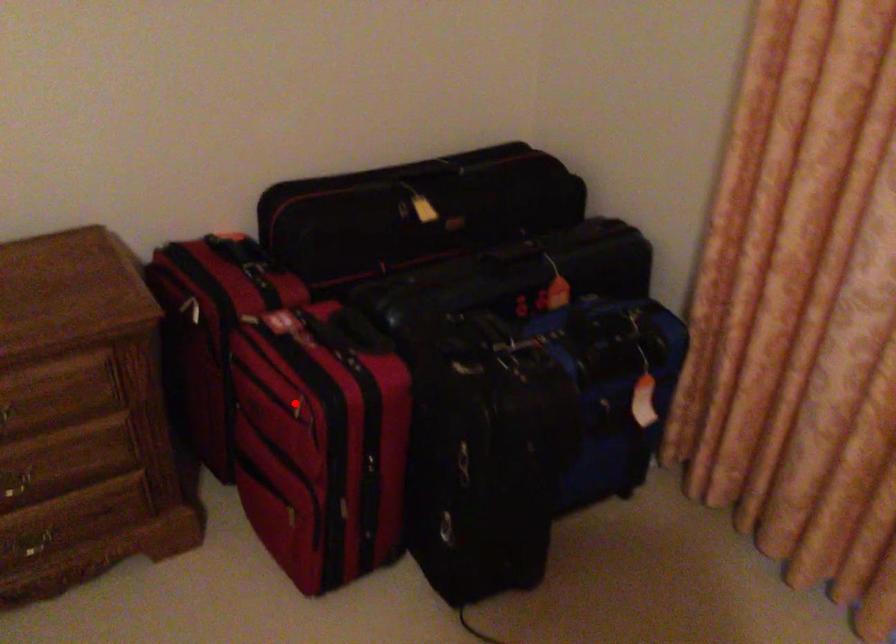
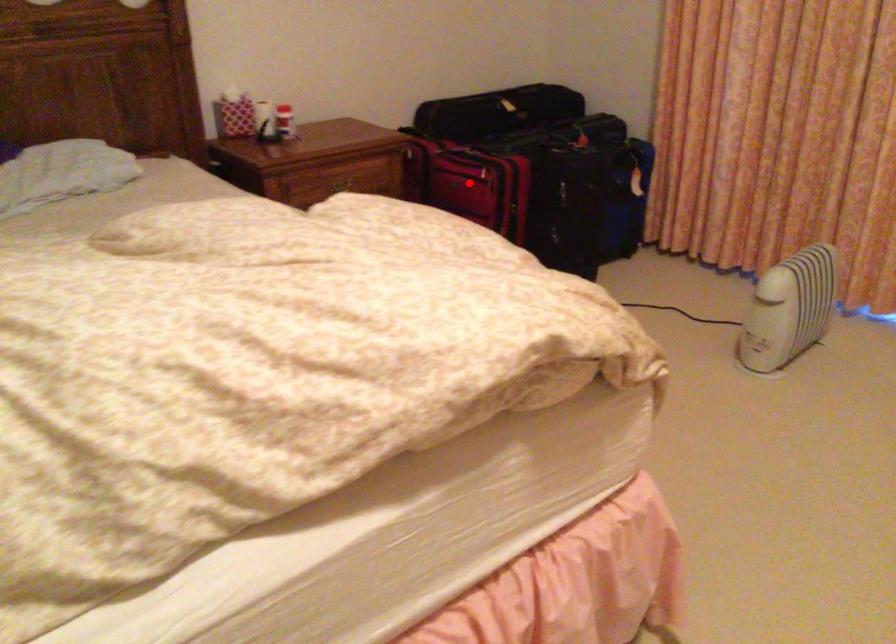
I am providing you with two images of the same scene from different viewpoints. A red point is marked on the first image and another point is marked on the second image. Is the marked point in image1 the same physical position as the marked point in image2?

Yes